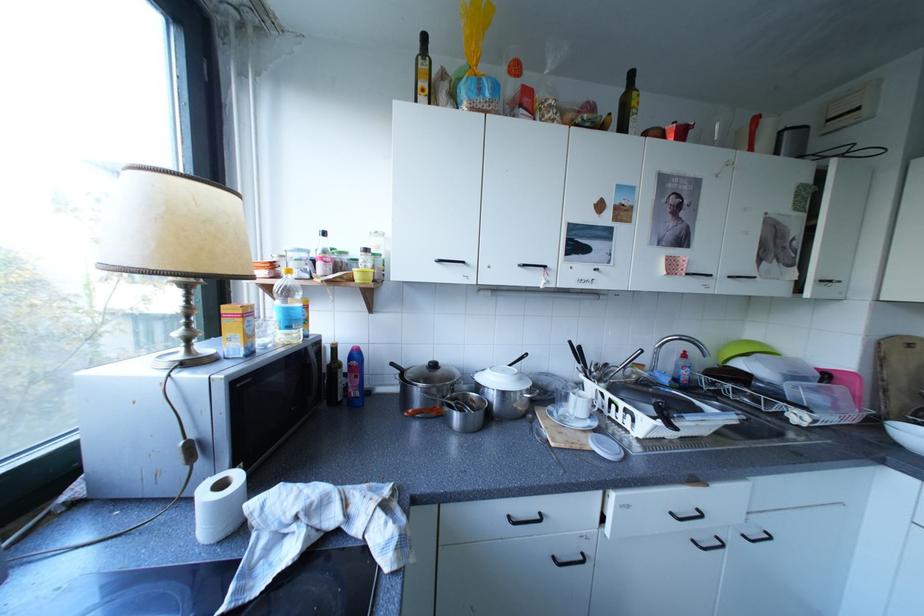
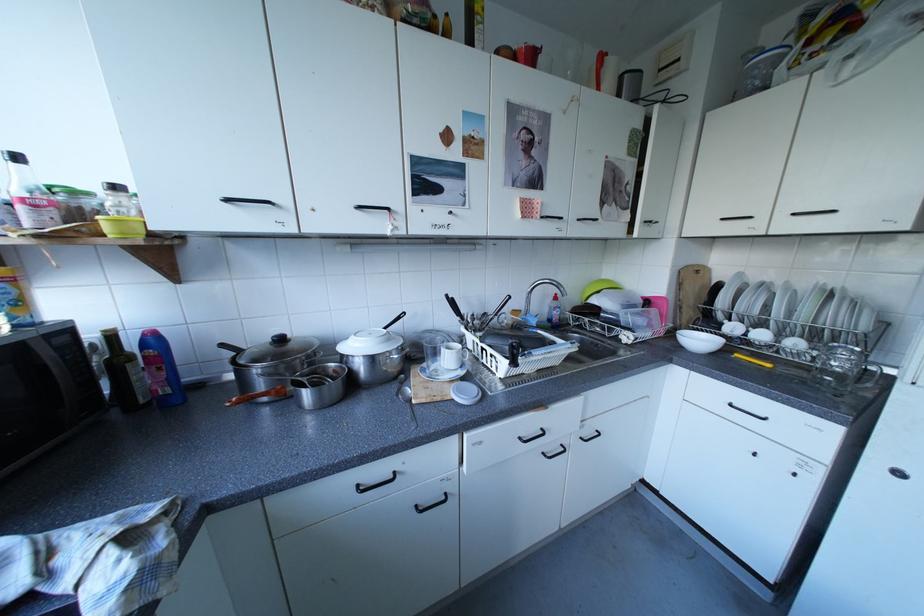
Find the pixel in the second image that matches point (685, 514) in the first image.

(532, 439)